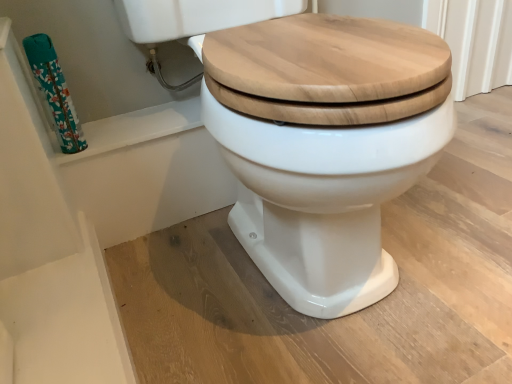
Question: Considering the relative sizes of white glossy toilet at center and teal floral-patterned toilet paper at left in the image provided, is white glossy toilet at center shorter than teal floral-patterned toilet paper at left?

Choices:
 (A) no
 (B) yes

Answer: (A)

Question: Is white glossy toilet at center further to the viewer compared to teal floral-patterned toilet paper at left?

Choices:
 (A) no
 (B) yes

Answer: (A)

Question: Considering the relative sizes of white glossy toilet at center and teal floral-patterned toilet paper at left in the image provided, is white glossy toilet at center thinner than teal floral-patterned toilet paper at left?

Choices:
 (A) no
 (B) yes

Answer: (A)

Question: From a real-world perspective, is white glossy toilet at center on top of teal floral-patterned toilet paper at left?

Choices:
 (A) yes
 (B) no

Answer: (B)

Question: Can you confirm if white glossy toilet at center is wider than teal floral-patterned toilet paper at left?

Choices:
 (A) no
 (B) yes

Answer: (B)

Question: Is white glossy toilet at center touching teal floral-patterned toilet paper at left?

Choices:
 (A) yes
 (B) no

Answer: (B)

Question: Can you confirm if teal floral-patterned toilet paper at left is thinner than white glossy toilet at center?

Choices:
 (A) yes
 (B) no

Answer: (A)

Question: Does teal floral-patterned toilet paper at left have a greater height compared to white glossy toilet at center?

Choices:
 (A) yes
 (B) no

Answer: (B)

Question: Is teal floral-patterned toilet paper at left shorter than white glossy toilet at center?

Choices:
 (A) no
 (B) yes

Answer: (B)

Question: Considering the relative sizes of teal floral-patterned toilet paper at left and white glossy toilet at center in the image provided, is teal floral-patterned toilet paper at left bigger than white glossy toilet at center?

Choices:
 (A) yes
 (B) no

Answer: (B)

Question: From a real-world perspective, is teal floral-patterned toilet paper at left located beneath white glossy toilet at center?

Choices:
 (A) no
 (B) yes

Answer: (A)

Question: From the image's perspective, is teal floral-patterned toilet paper at left located above white glossy toilet at center?

Choices:
 (A) no
 (B) yes

Answer: (B)

Question: From the image's perspective, is teal floral-patterned toilet paper at left above or below white glossy toilet at center?

Choices:
 (A) below
 (B) above

Answer: (B)